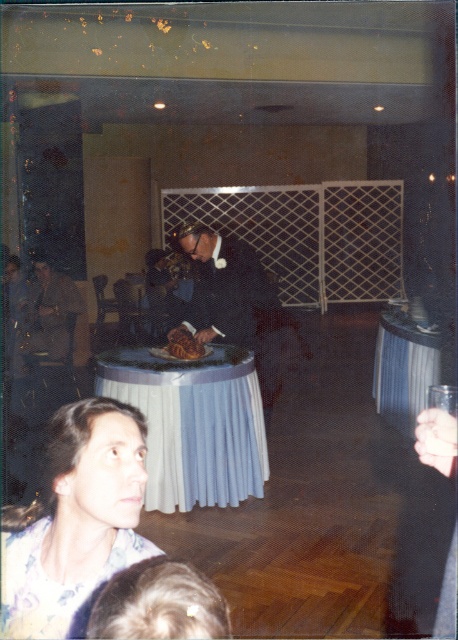
Question: Which object is the farthest from the shiny black suit at center?

Choices:
 (A) floral print blouse at lower left
 (B) brown leather jacket at left
 (C) blue pleated tablecloth at center

Answer: (A)

Question: Which point is closer to the camera?

Choices:
 (A) white cloth table at center
 (B) shiny black suit at center
 (C) floral print blouse at lower left
 (D) golden brown pastry at center

Answer: (C)

Question: Which of the following is the closest to the observer?

Choices:
 (A) (48, 288)
 (B) (96, 512)
 (C) (245, 483)

Answer: (B)

Question: Is white cloth table at center closer to the viewer compared to golden brown pastry at center?

Choices:
 (A) no
 (B) yes

Answer: (A)

Question: Can you confirm if blue pleated tablecloth at center is positioned above golden brown pastry at center?

Choices:
 (A) no
 (B) yes

Answer: (A)

Question: Is floral print blouse at lower left wider than brown leather jacket at left?

Choices:
 (A) yes
 (B) no

Answer: (B)